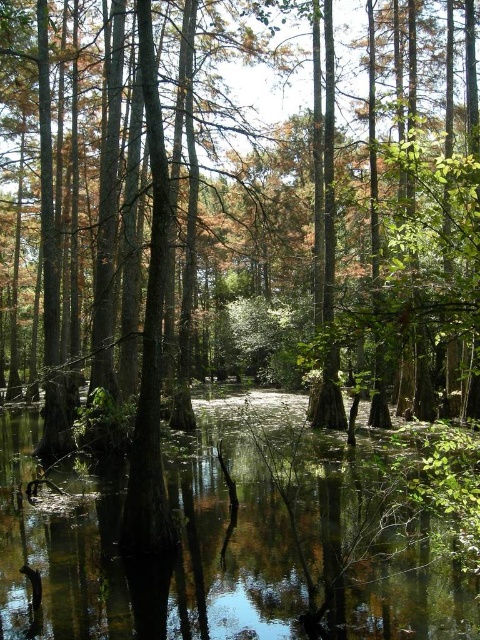
Who is more distant from viewer, (283, 180) or (143, 600)?

The point (283, 180) is more distant.

Which is above, green matte tree at center or green reflective water at center?

green matte tree at center

You are a GUI agent. You are given a task and a screenshot of the screen. Output one action in this format:
    pyautogui.click(x=<x>, y=<y>)
    Task: Click on the green matte tree at center
    
    Given the screenshot: What is the action you would take?
    pos(264,216)